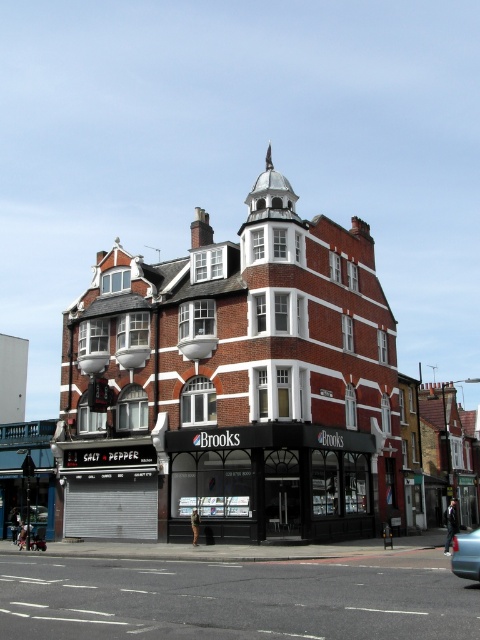
You are driving a car and want to park it on the black asphalt road at lower center. However, there is a metallic blue sedan at lower right blocking the way. Based on the scene description, can you determine if there is enough space to park your car on the road without moving the sedan?

The black asphalt road at lower center is to the left of the metallic blue sedan at lower right, so there might be enough space to park your car on the road without moving the sedan as long as you position it to the left side of the sedan.

You are a pedestrian standing on the black asphalt road at lower center and want to reach the metallic blue sedan at lower right. Which direction should you move to get there?

→ The black asphalt road at lower center is below the metallic blue sedan at lower right, so you should move downward along the black asphalt road at lower center towards the metallic blue sedan at lower right.

Based on the photo, you are a delivery driver approaching the building and need to park your vehicle. The vehicle requires a space wider than the matte black storefront at center. Can you determine if the black asphalt road at lower center provides sufficient width for parking?

The black asphalt road at lower center is wider than the matte black storefront at center, so yes, the road provides enough width for parking the vehicle.